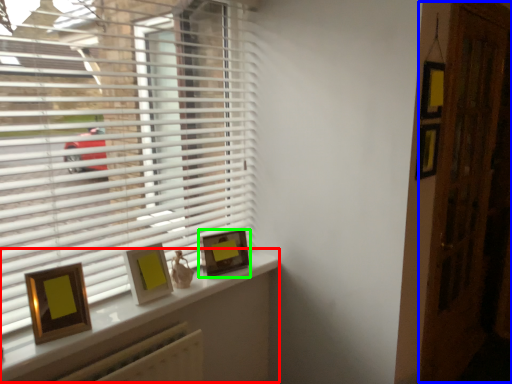
Question: Which object is positioned farthest from window (highlighted by a red box)? Select from screen door (highlighted by a blue box) and picture frame (highlighted by a green box).

Choices:
 (A) screen door
 (B) picture frame

Answer: (A)